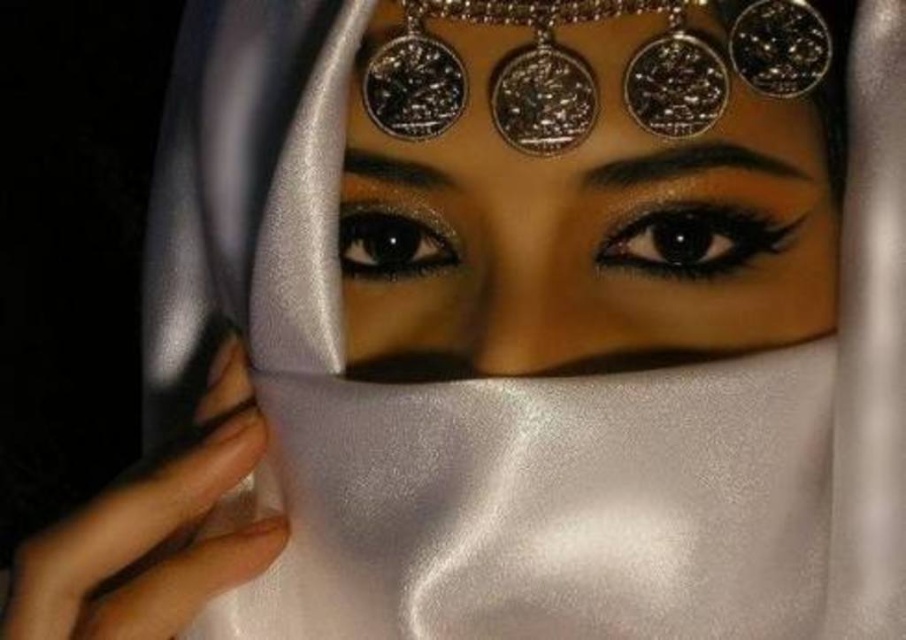
Looking at this image, does black matte eye at center appear on the left side of shiny black eye at center?

No, black matte eye at center is not to the left of shiny black eye at center.

Is black matte eye at center to the right of shiny black eye at center from the viewer's perspective?

Correct, you'll find black matte eye at center to the right of shiny black eye at center.

Is point (753, 212) positioned after point (442, 259)?

No, it is not.

You are a GUI agent. You are given a task and a screenshot of the screen. Output one action in this format:
    pyautogui.click(x=<x>, y=<y>)
    Task: Click on the black matte eye at center
    
    Given the screenshot: What is the action you would take?
    pyautogui.click(x=695, y=240)

Which is more to the right, metallic silver coins at center or black matte eye at center?

Positioned to the right is black matte eye at center.

Does point (447, 305) come farther from viewer compared to point (764, 227)?

Yes, point (447, 305) is behind point (764, 227).

This screenshot has height=640, width=906. Describe the element at coordinates (584, 184) in the screenshot. I see `metallic silver coins at center` at that location.

Where is `metallic silver coins at center`? The width and height of the screenshot is (906, 640). metallic silver coins at center is located at coordinates (584, 184).

Is metallic silver coins at center behind shiny black eye at center?

No.

Based on the photo, does metallic silver coins at center appear on the right side of shiny black eye at center?

Indeed, metallic silver coins at center is positioned on the right side of shiny black eye at center.

Image resolution: width=906 pixels, height=640 pixels. What do you see at coordinates (584, 184) in the screenshot? I see `metallic silver coins at center` at bounding box center [584, 184].

This screenshot has height=640, width=906. Identify the location of metallic silver coins at center. (584, 184).